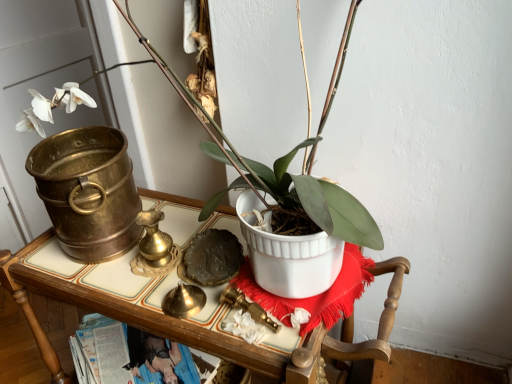
Question: Does white matte pot at center turn towards white ceramic pot at center?

Choices:
 (A) no
 (B) yes

Answer: (A)

Question: Is white matte pot at center not within white ceramic pot at center?

Choices:
 (A) no
 (B) yes

Answer: (B)

Question: From a real-world perspective, is white matte pot at center on top of white ceramic pot at center?

Choices:
 (A) yes
 (B) no

Answer: (A)

Question: Could white ceramic pot at center be considered to be inside white matte pot at center?

Choices:
 (A) no
 (B) yes

Answer: (A)

Question: Considering the relative sizes of white matte pot at center and white ceramic pot at center in the image provided, is white matte pot at center thinner than white ceramic pot at center?

Choices:
 (A) yes
 (B) no

Answer: (A)

Question: Can you confirm if white matte pot at center is bigger than white ceramic pot at center?

Choices:
 (A) no
 (B) yes

Answer: (A)

Question: From a real-world perspective, is white ceramic pot at center located beneath white matte pot at center?

Choices:
 (A) yes
 (B) no

Answer: (A)

Question: Considering the relative sizes of white ceramic pot at center and white matte pot at center in the image provided, is white ceramic pot at center thinner than white matte pot at center?

Choices:
 (A) no
 (B) yes

Answer: (A)

Question: Can you confirm if white ceramic pot at center is smaller than white matte pot at center?

Choices:
 (A) yes
 (B) no

Answer: (B)

Question: From the image's perspective, is white ceramic pot at center below white matte pot at center?

Choices:
 (A) yes
 (B) no

Answer: (A)

Question: Is white matte pot at center located within white ceramic pot at center?

Choices:
 (A) yes
 (B) no

Answer: (B)

Question: Does white ceramic pot at center touch white matte pot at center?

Choices:
 (A) no
 (B) yes

Answer: (A)

Question: From a real-world perspective, is white matte pot at center above or below white ceramic pot at center?

Choices:
 (A) above
 (B) below

Answer: (A)